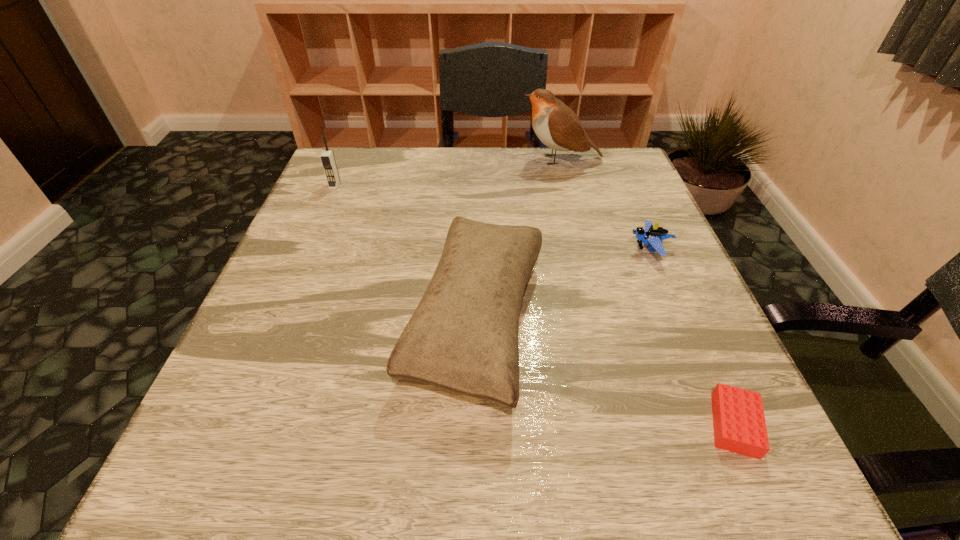
Find the location of a particular element. The height and width of the screenshot is (540, 960). free region located at the face of the bird is located at coordinates (437, 159).

Image resolution: width=960 pixels, height=540 pixels. In order to click on free space located at the face of the bird in this screenshot , I will do `click(372, 159)`.

At what (x,y) coordinates should I click in order to perform the action: click on free space located 0.350m on the front-facing side of the fourth shortest object. Please return your answer as a coordinate pair (x, y). Looking at the image, I should click on (288, 295).

Locate an element on the screen. The width and height of the screenshot is (960, 540). free space located 0.320m on the back of the cushion is located at coordinates (477, 166).

Find the location of a particular element. The height and width of the screenshot is (540, 960). vacant space situated 0.130m on the front-facing side of the fourth tallest object is located at coordinates (565, 249).

Locate an element on the screen. vacant space located on the front-facing side of the fourth tallest object is located at coordinates (483, 249).

Locate an element on the screen. vacant region located on the front-facing side of the fourth tallest object is located at coordinates (526, 249).

The image size is (960, 540). Identify the location of vacant region located 0.360m on the left of the shortest object. (453, 425).

Where is `bird at the far edge`? The height and width of the screenshot is (540, 960). bird at the far edge is located at coordinates (557, 126).

Where is `cellular telephone at the far edge`? The width and height of the screenshot is (960, 540). cellular telephone at the far edge is located at coordinates (327, 157).